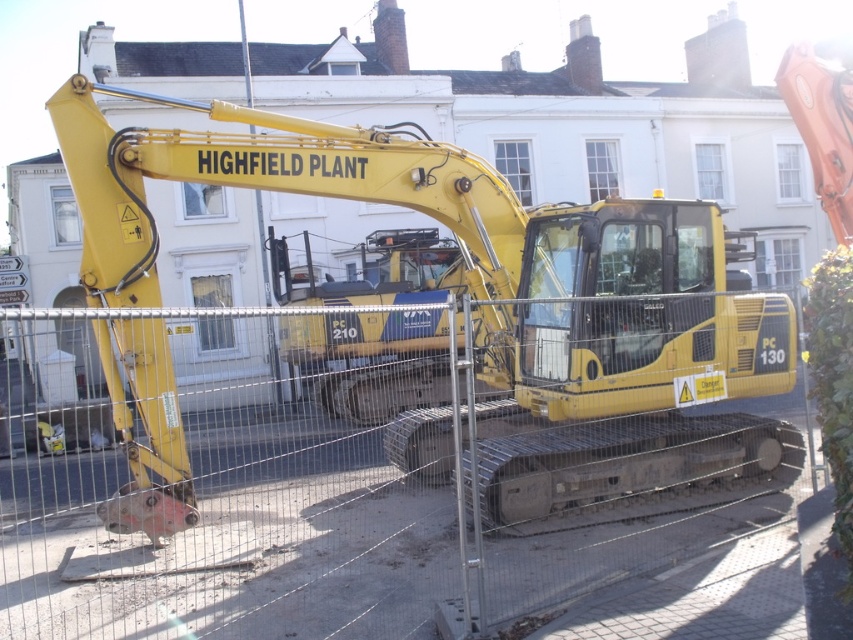
Is metal mesh fence at center positioned behind yellow rubber excavator at center?

No, it is not.

Describe the element at coordinates (334, 499) in the screenshot. I see `metal mesh fence at center` at that location.

You are a GUI agent. You are given a task and a screenshot of the screen. Output one action in this format:
    pyautogui.click(x=<x>, y=<y>)
    Task: Click on the metal mesh fence at center
    This screenshot has width=853, height=640.
    Given the screenshot: What is the action you would take?
    point(334,499)